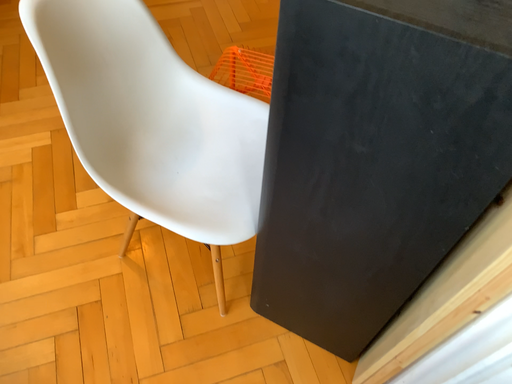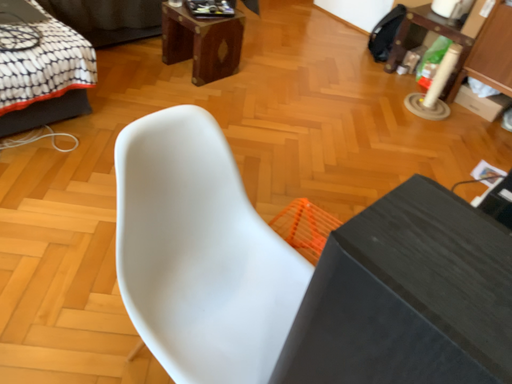
Question: How did the camera likely rotate when shooting the video?

Choices:
 (A) rotated upward
 (B) rotated downward

Answer: (A)